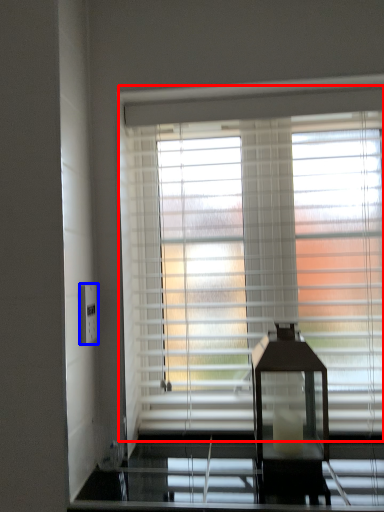
Question: Among these objects, which one is nearest to the camera, window blind (highlighted by a red box) or electric outlet (highlighted by a blue box)?

Choices:
 (A) window blind
 (B) electric outlet

Answer: (B)